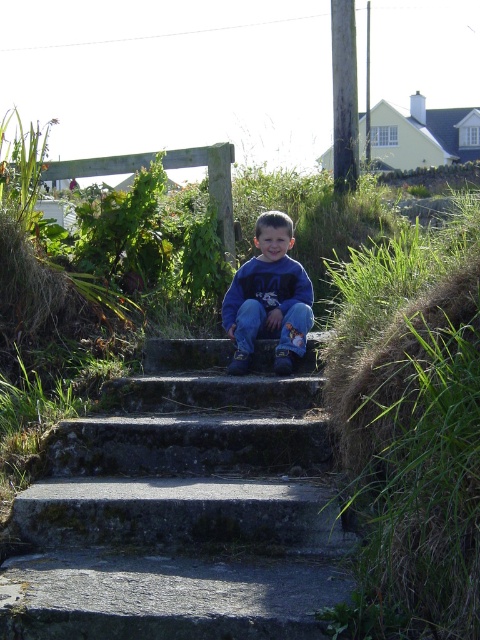
Does point (267, 340) lie in front of point (244, 333)?

No, (267, 340) is further to viewer.

Who is lower down, concrete stairs at center or blue cotton sweatshirt at center?

concrete stairs at center is below.

Who is more forward, (149, 525) or (257, 316)?

Positioned in front is point (149, 525).

Find the location of a particular element. concrete stairs at center is located at coordinates (182, 508).